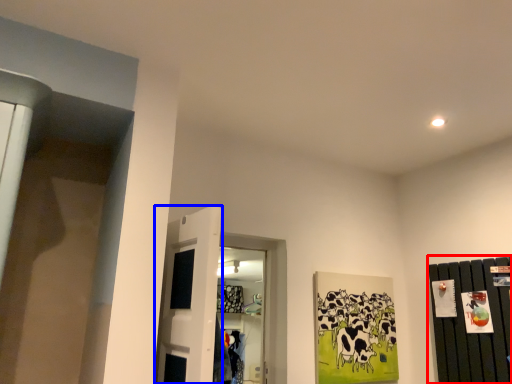
Question: Which object appears closest to the camera in this image, dresser (highlighted by a red box) or door (highlighted by a blue box)?

Choices:
 (A) dresser
 (B) door

Answer: (B)